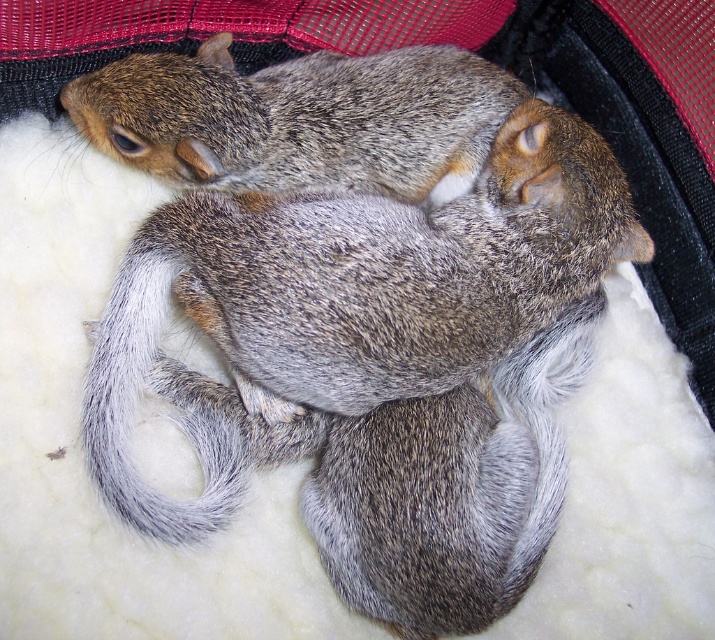
Is gray-furred squirrel at center below gray fuzzy tail at lower center?

No, gray-furred squirrel at center is not below gray fuzzy tail at lower center.

Image resolution: width=715 pixels, height=640 pixels. Describe the element at coordinates (355, 292) in the screenshot. I see `gray-furred squirrel at center` at that location.

The height and width of the screenshot is (640, 715). Describe the element at coordinates (355, 292) in the screenshot. I see `gray-furred squirrel at center` at that location.

At what (x,y) coordinates should I click in order to perform the action: click on gray-furred squirrel at center. Please return your answer as a coordinate pair (x, y). The height and width of the screenshot is (640, 715). Looking at the image, I should click on (355, 292).

Does gray-furred squirrel at center appear on the left side of gray-furred squirrel at upper center?

No, gray-furred squirrel at center is not to the left of gray-furred squirrel at upper center.

Does gray-furred squirrel at center appear on the right side of gray-furred squirrel at upper center?

Yes, gray-furred squirrel at center is to the right of gray-furred squirrel at upper center.

The width and height of the screenshot is (715, 640). I want to click on gray-furred squirrel at center, so click(x=355, y=292).

Who is positioned more to the left, gray-furred squirrel at upper center or gray fuzzy tail at lower center?

From the viewer's perspective, gray fuzzy tail at lower center appears more on the left side.

Which is above, gray-furred squirrel at upper center or gray fuzzy tail at lower center?

gray-furred squirrel at upper center

Which is in front, point (420, 58) or point (104, 433)?

Point (104, 433) is more forward.

What are the coordinates of `gray-furred squirrel at upper center` in the screenshot? It's located at (300, 118).